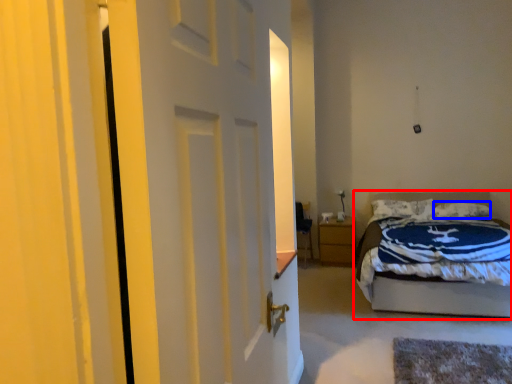
Question: Which of the following is the closest to the observer, bed (highlighted by a red box) or pillow (highlighted by a blue box)?

Choices:
 (A) bed
 (B) pillow

Answer: (A)